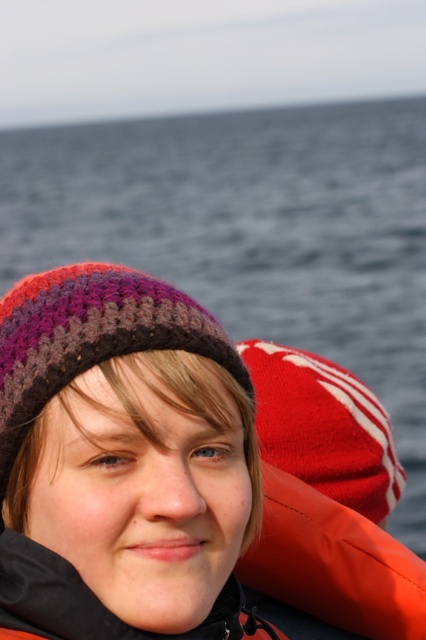
Question: Is knitted woolen hat at left bigger than orange synthetic life jacket at right?

Choices:
 (A) yes
 (B) no

Answer: (B)

Question: Does knitted woolen hat at center have a lesser width compared to knitted woolen hat at left?

Choices:
 (A) yes
 (B) no

Answer: (B)

Question: Which of the following is the closest to the observer?

Choices:
 (A) orange synthetic life jacket at right
 (B) knitted woolen hat at left

Answer: (B)

Question: Which of the following is the farthest from the observer?

Choices:
 (A) orange synthetic life jacket at right
 (B) knitted woolen hat at left
 (C) knitted woolen hat at center

Answer: (A)

Question: Does knitted woolen hat at left appear on the left side of orange synthetic life jacket at right?

Choices:
 (A) no
 (B) yes

Answer: (B)

Question: Among these points, which one is farthest from the camera?

Choices:
 (A) (42, 314)
 (B) (273, 490)
 (C) (400, 608)

Answer: (B)